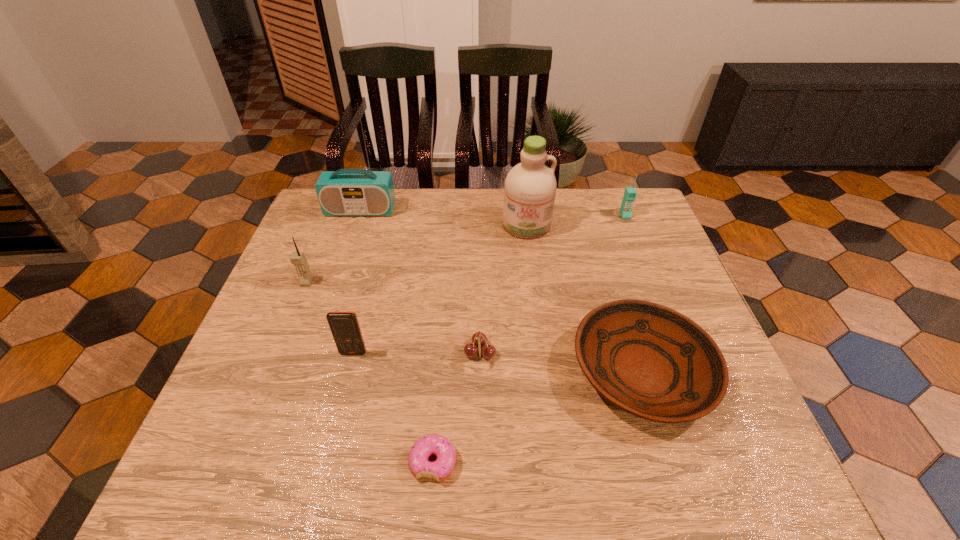
The height and width of the screenshot is (540, 960). Identify the location of radio receiver. (346, 192).

This screenshot has width=960, height=540. I want to click on cleansing agent, so click(530, 187).

Locate an element on the screen. the fifth nearest object is located at coordinates (299, 260).

The image size is (960, 540). What are the coordinates of `the leftmost cellular telephone` in the screenshot? It's located at (299, 260).

Where is `the farthest cellular telephone`? This screenshot has height=540, width=960. the farthest cellular telephone is located at coordinates (630, 193).

The height and width of the screenshot is (540, 960). Find the location of `the second cellular telephone from right to left`. the second cellular telephone from right to left is located at coordinates (344, 326).

Identify the location of the fifth object from left to right. The image size is (960, 540). (479, 339).

Identify the location of plate. (651, 361).

Identify the location of doughnut. (434, 444).

Where is `the fifth object from right to left`? This screenshot has width=960, height=540. the fifth object from right to left is located at coordinates (434, 444).